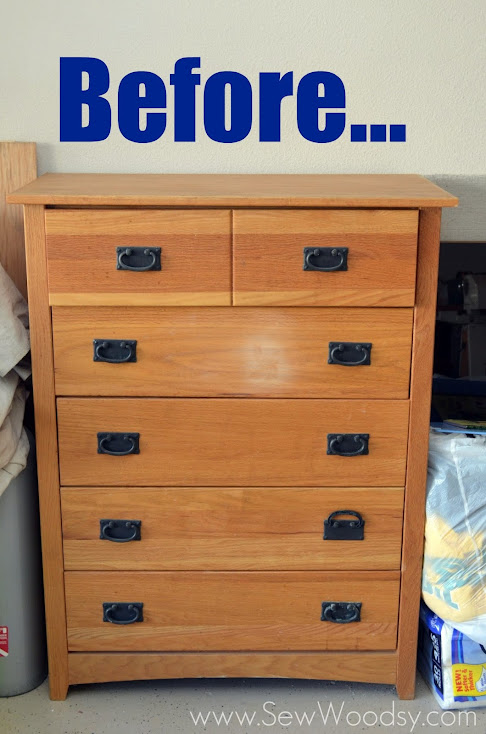
Identify the location of wall. The height and width of the screenshot is (734, 486). (250, 39).